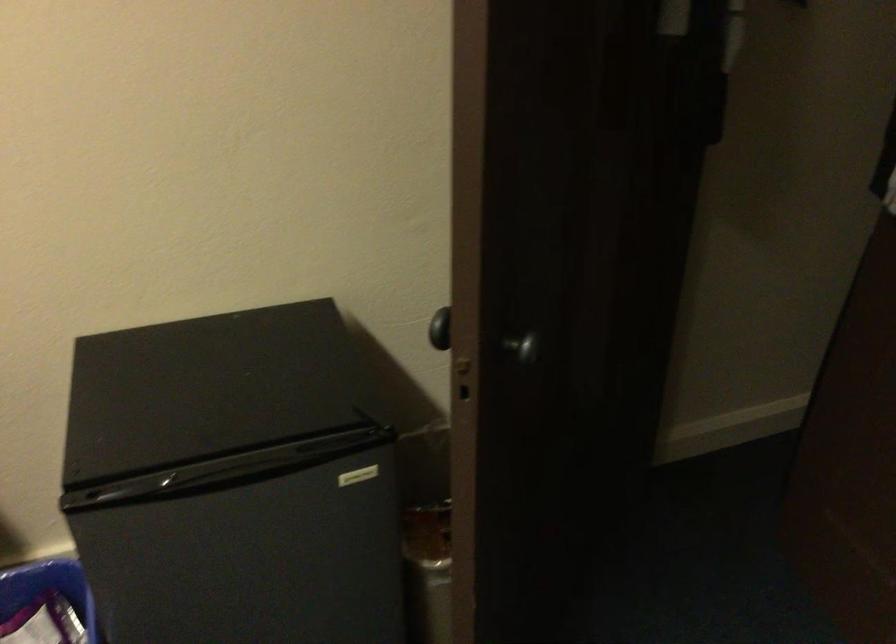
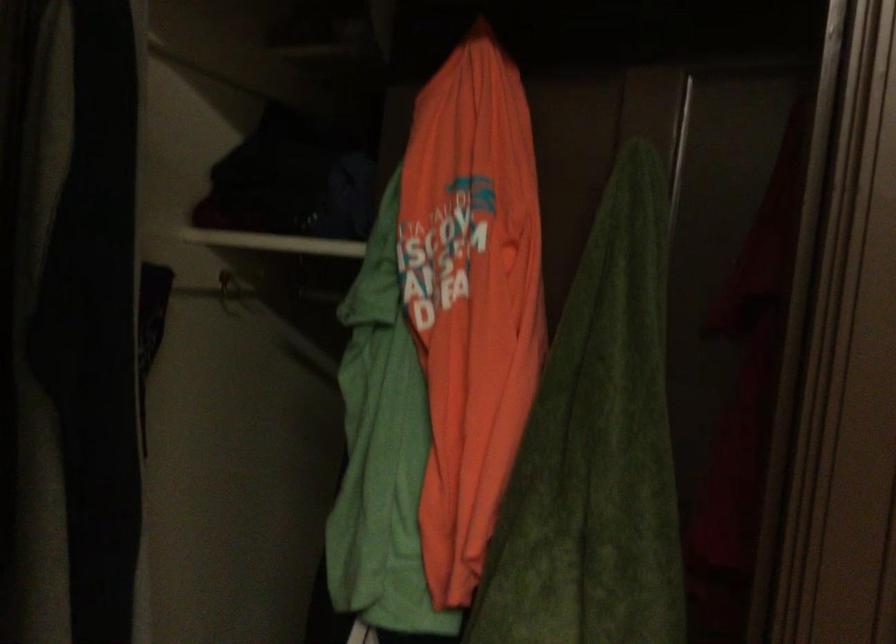
Question: The first image is from the beginning of the video and the second image is from the end. How did the camera likely rotate when shooting the video?

Choices:
 (A) Left
 (B) Right
 (C) Up
 (D) Down

Answer: (B)